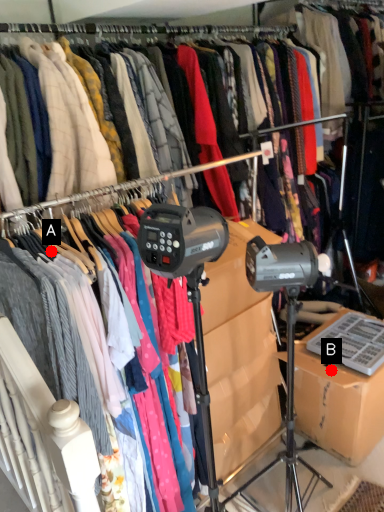
Question: Two points are circled on the image, labeled by A and B beside each circle. Among these points, which one is nearest to the camera?

Choices:
 (A) A is closer
 (B) B is closer

Answer: (A)